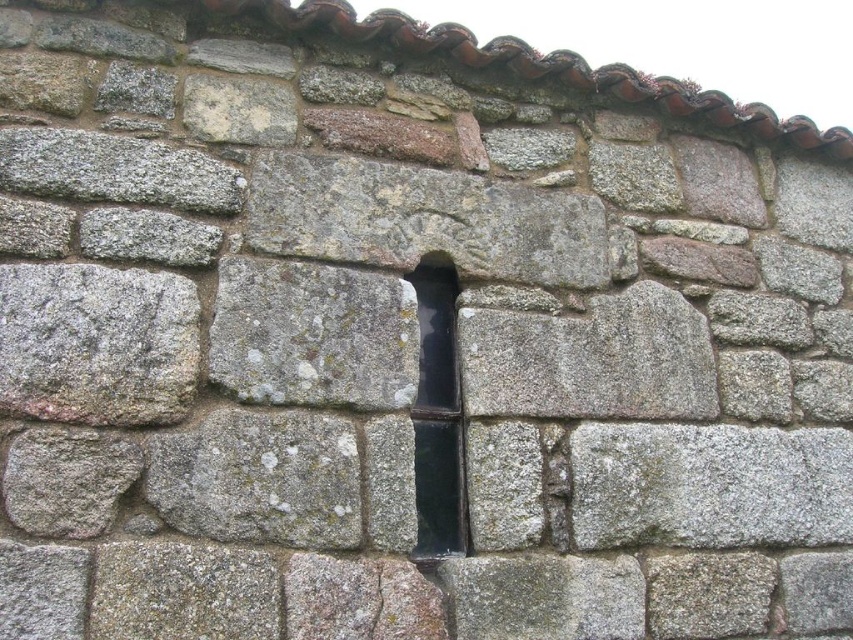
Question: Among these objects, which one is nearest to the camera?

Choices:
 (A) black glass window at center
 (B) gray stone crack at center

Answer: (B)

Question: Which of the following is the farthest from the observer?

Choices:
 (A) (450, 392)
 (B) (372, 573)

Answer: (A)

Question: Is black glass window at center behind gray stone crack at center?

Choices:
 (A) yes
 (B) no

Answer: (A)

Question: Is black glass window at center wider than gray stone crack at center?

Choices:
 (A) no
 (B) yes

Answer: (B)

Question: Which point appears closest to the camera in this image?

Choices:
 (A) (439, 301)
 (B) (375, 563)

Answer: (B)

Question: Is black glass window at center above gray stone crack at center?

Choices:
 (A) yes
 (B) no

Answer: (A)